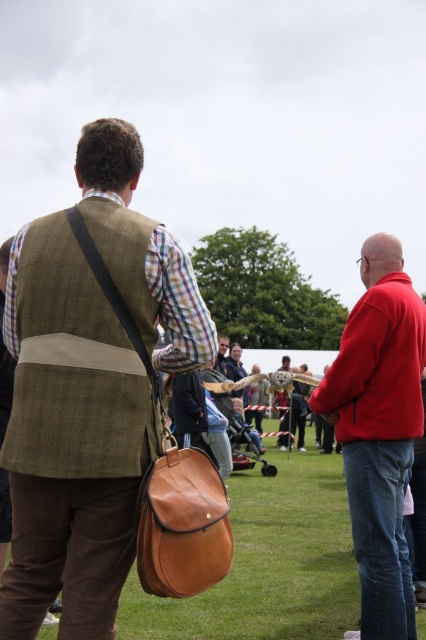
You are attending an outdoor event and notice two people dressed in traditional attire. The first person is wearing a matte brown vest at center, and the second is wearing a red fleece jacket at right. Which of these two garments is smaller in size?

The matte brown vest at center is smaller in size compared to the red fleece jacket at right.